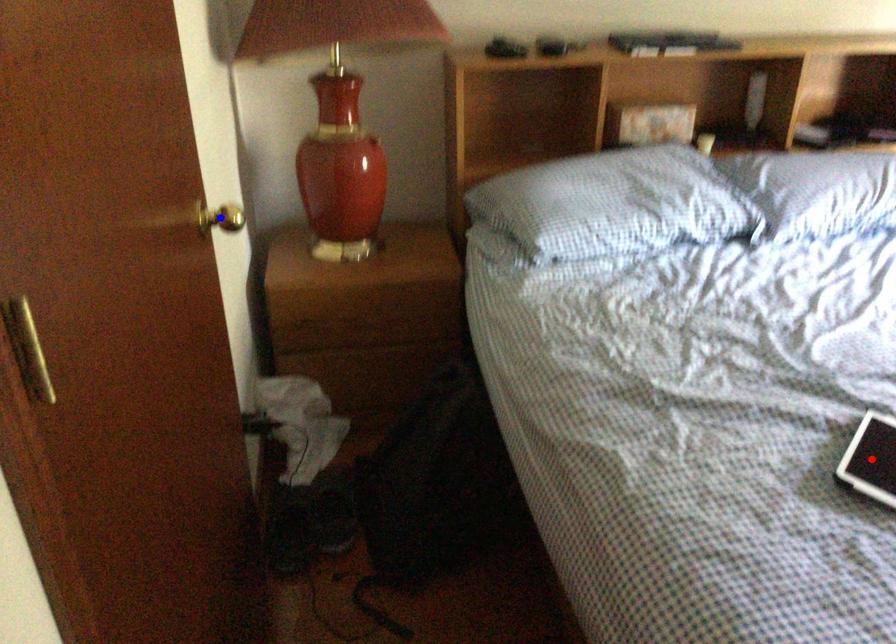
Question: In the image, two points are highlighted. Which point is nearer to the camera? Reply with the corresponding letter.

Choices:
 (A) blue point
 (B) red point

Answer: (A)